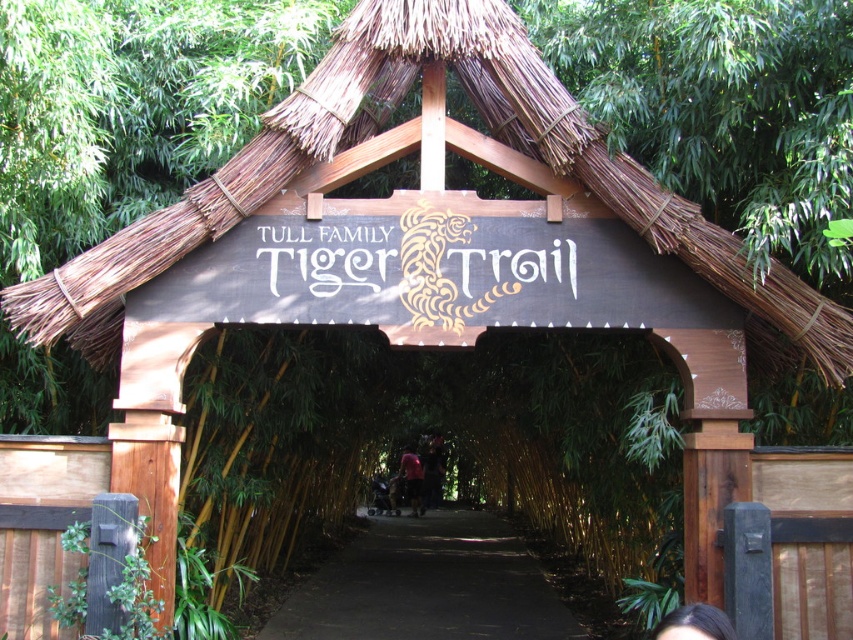
Is point (677, 616) positioned after point (434, 500)?

No, (677, 616) is closer to viewer.

Is dark brown hair at lower center bigger than dark brown leather jacket at center?

Actually, dark brown hair at lower center might be smaller than dark brown leather jacket at center.

Is point (701, 621) behind point (439, 492)?

No, it is not.

What are the coordinates of `dark brown hair at lower center` in the screenshot? It's located at (694, 624).

Where is `dirt path at center`? The width and height of the screenshot is (853, 640). dirt path at center is located at coordinates (427, 586).

Is dirt path at center to the left of dark red fabric shirt at center from the viewer's perspective?

No, dirt path at center is not to the left of dark red fabric shirt at center.

At what (x,y) coordinates should I click in order to perform the action: click on dirt path at center. Please return your answer as a coordinate pair (x, y). Looking at the image, I should click on (427, 586).

Can you confirm if dirt path at center is bigger than dark brown hair at lower center?

Correct, dirt path at center is larger in size than dark brown hair at lower center.

Between dirt path at center and dark brown hair at lower center, which one appears on the right side from the viewer's perspective?

dark brown hair at lower center

Identify the location of dirt path at center. (427, 586).